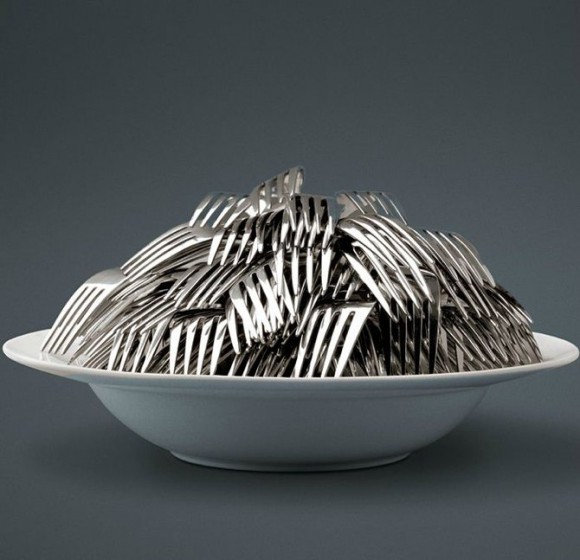
The height and width of the screenshot is (560, 580). Identify the location of rim of bowl. (14, 357).